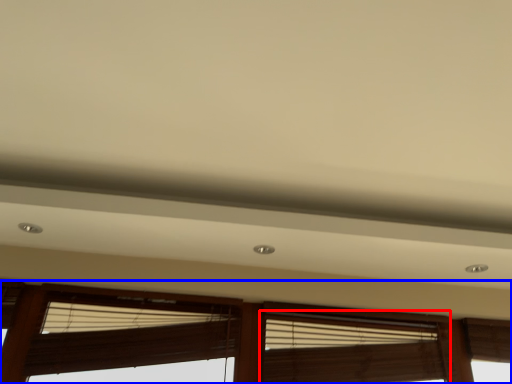
Question: Which point is closer to the camera, window blind (highlighted by a red box) or window (highlighted by a blue box)?

Choices:
 (A) window blind
 (B) window

Answer: (B)